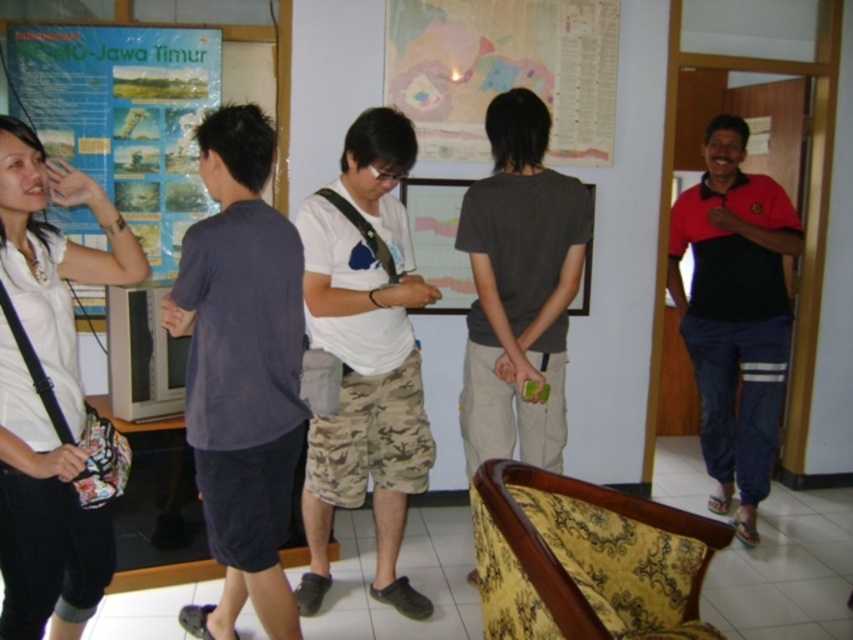
How far apart are matte paper poster at upper left and matte paper map at upper center?

matte paper poster at upper left and matte paper map at upper center are 3.81 feet apart from each other.

Does point (119, 172) come behind point (450, 80)?

No.

Between point (42, 28) and point (509, 0), which one is positioned in front?

Point (42, 28) is more forward.

Image resolution: width=853 pixels, height=640 pixels. I want to click on matte paper poster at upper left, so click(x=123, y=116).

Identify the location of white fabric purse at left. (44, 516).

Does white fabric purse at left appear on the right side of black cotton shirt at right?

No, white fabric purse at left is not to the right of black cotton shirt at right.

In order to click on white fabric purse at left in this screenshot , I will do `click(44, 516)`.

In order to click on white fabric purse at left in this screenshot , I will do `click(44, 516)`.

Does white cotton shirt at center have a smaller size compared to matte gray shirt at center?

Incorrect, white cotton shirt at center is not smaller in size than matte gray shirt at center.

Describe the element at coordinates (364, 355) in the screenshot. I see `white cotton shirt at center` at that location.

The height and width of the screenshot is (640, 853). I want to click on white cotton shirt at center, so click(364, 355).